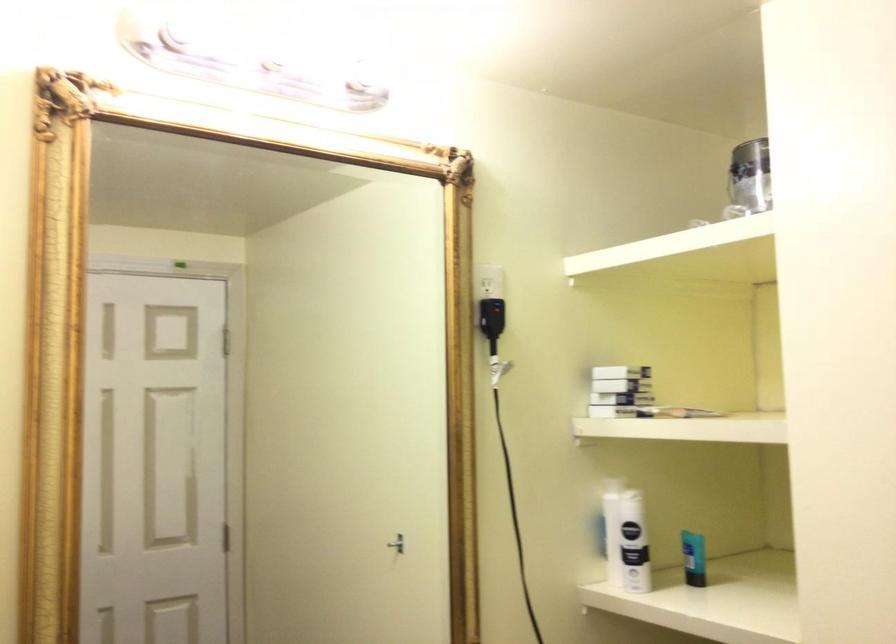
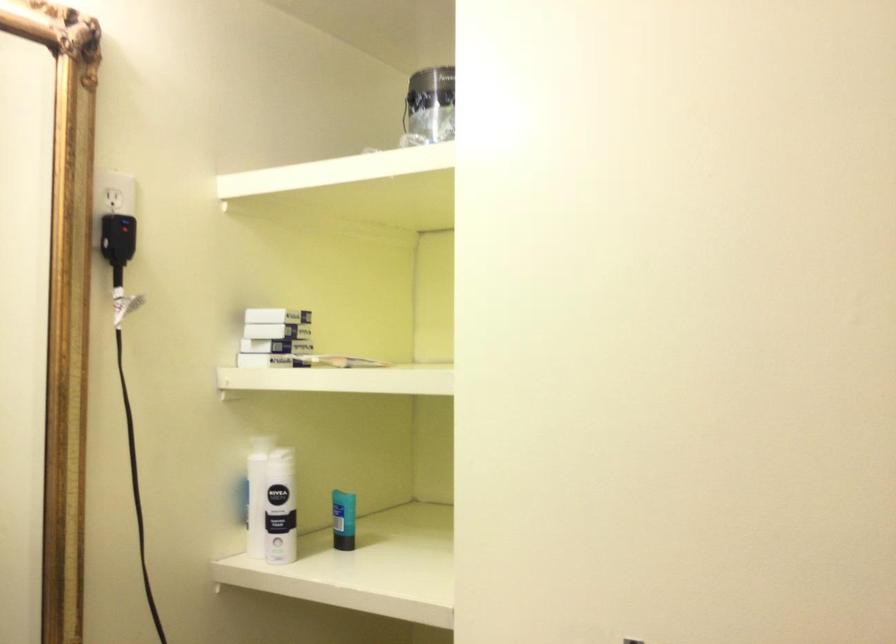
Find the pixel in the second image that matches point (618, 413) in the first image.

(260, 362)